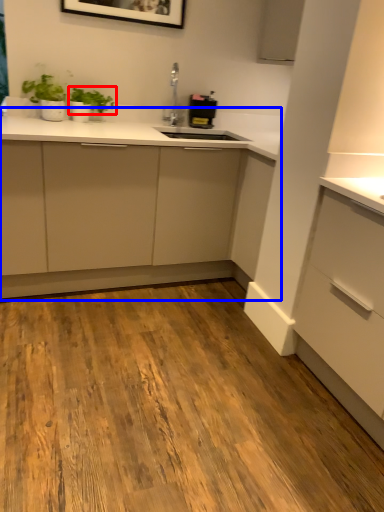
Question: Which object is closer to the camera taking this photo, plant (highlighted by a red box) or cabinetry (highlighted by a blue box)?

Choices:
 (A) plant
 (B) cabinetry

Answer: (B)